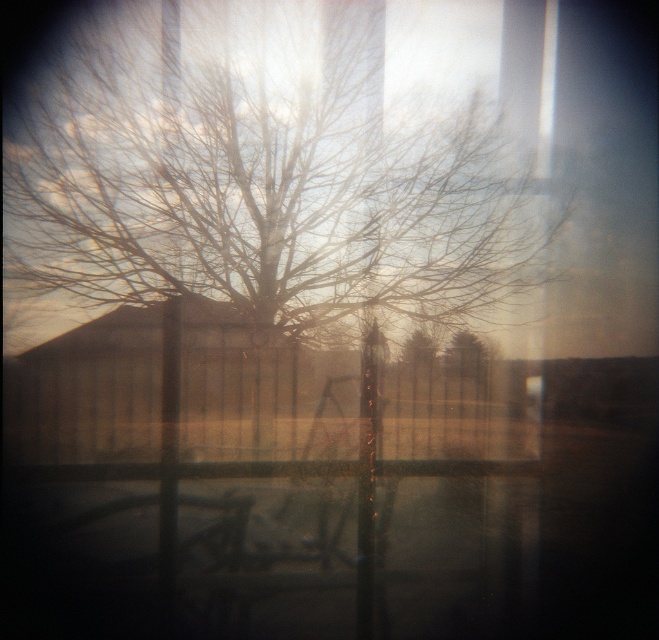
Can you confirm if green matte tree at center is smaller than bare branches at center?

No, green matte tree at center is not smaller than bare branches at center.

Which is more to the left, green matte tree at center or bare branches at center?

bare branches at center is more to the left.

The image size is (659, 640). I want to click on green matte tree at center, so click(x=465, y=355).

Is brown wooden fence at center bigger than bare branches at center?

Correct, brown wooden fence at center is larger in size than bare branches at center.

Does point (38, 404) come farther from viewer compared to point (409, 339)?

No.

In order to click on brown wooden fence at center in this screenshot , I will do `click(272, 458)`.

The height and width of the screenshot is (640, 659). Identify the location of brown wooden fence at center. (272, 458).

What do you see at coordinates (272, 458) in the screenshot?
I see `brown wooden fence at center` at bounding box center [272, 458].

I want to click on brown wooden fence at center, so click(x=272, y=458).

Is point (513, 513) closer to viewer compared to point (474, 346)?

Yes, it is in front of point (474, 346).

At what (x,y) coordinates should I click in order to perform the action: click on brown wooden fence at center. Please return your answer as a coordinate pair (x, y). Image resolution: width=659 pixels, height=640 pixels. Looking at the image, I should click on (272, 458).